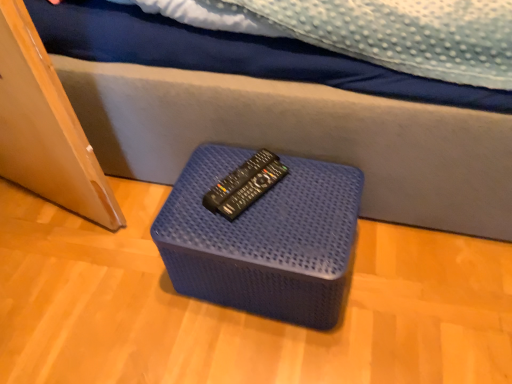
Where is `free space to the left of black plastic remote at center`? This screenshot has height=384, width=512. free space to the left of black plastic remote at center is located at coordinates (193, 188).